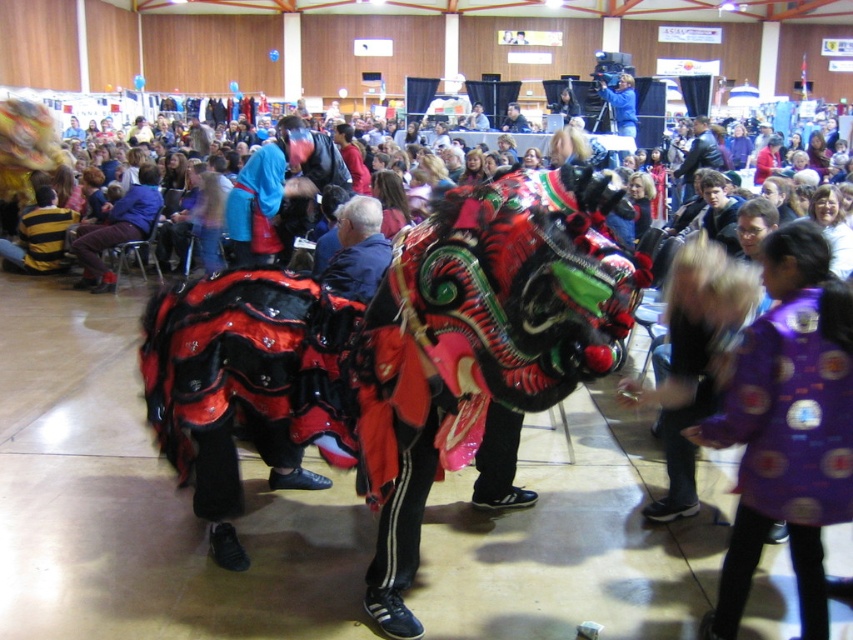
Based on the photo, does purple fabric costume at lower right have a smaller size compared to matte blue jacket at center?

Indeed, purple fabric costume at lower right has a smaller size compared to matte blue jacket at center.

Is purple fabric costume at lower right positioned at the back of matte blue jacket at center?

No.

Is point (761, 540) farther from viewer compared to point (515, 129)?

That is False.

This screenshot has height=640, width=853. In order to click on purple fabric costume at lower right in this screenshot , I will do `click(787, 444)`.

You are a GUI agent. You are given a task and a screenshot of the screen. Output one action in this format:
    pyautogui.click(x=<x>, y=<y>)
    Task: Click on the purple fabric costume at lower right
    The image size is (853, 640).
    Given the screenshot: What is the action you would take?
    pyautogui.click(x=787, y=444)

Is leather jacket at center to the left of matte blue jacket at center from the viewer's perspective?

No, leather jacket at center is not to the left of matte blue jacket at center.

Does point (703, 120) come closer to viewer compared to point (509, 109)?

Yes, point (703, 120) is closer to viewer.

Who is more distant from viewer, (693, 145) or (505, 124)?

Point (505, 124)

This screenshot has height=640, width=853. Find the location of `leather jacket at center`. leather jacket at center is located at coordinates (698, 156).